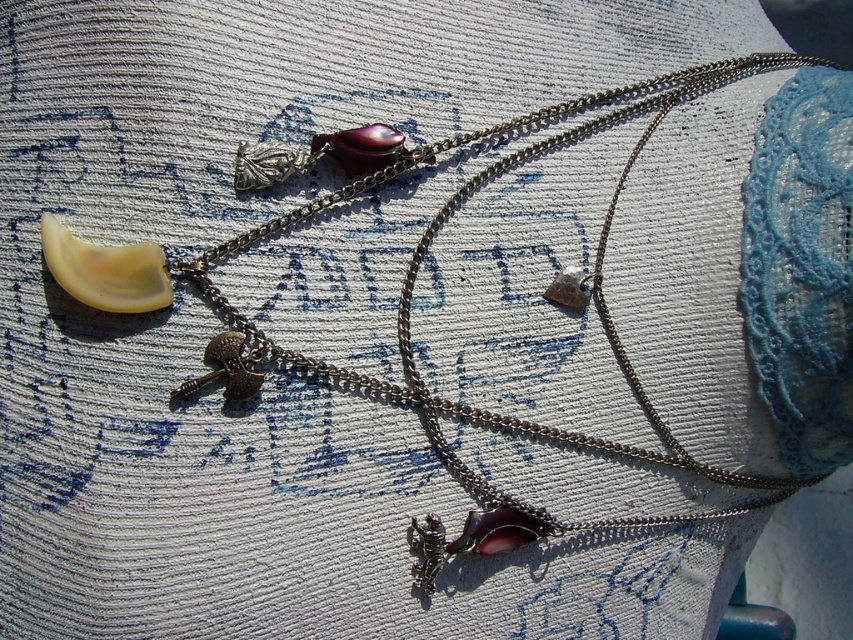
Question: Which of the following is the farthest from the observer?

Choices:
 (A) matte silver charm at center
 (B) gold metallic hammer at center

Answer: (A)

Question: Is gold metallic hammer at center further to the viewer compared to matte silver charm at center?

Choices:
 (A) no
 (B) yes

Answer: (A)

Question: Which of the following is the farthest from the observer?

Choices:
 (A) (575, 292)
 (B) (247, 380)

Answer: (A)

Question: Is the position of gold metallic hammer at center less distant than that of matte silver charm at center?

Choices:
 (A) no
 (B) yes

Answer: (B)

Question: Among these objects, which one is farthest from the camera?

Choices:
 (A) gold metallic hammer at center
 (B) matte silver charm at center

Answer: (B)

Question: Does gold metallic hammer at center have a lesser width compared to matte silver charm at center?

Choices:
 (A) no
 (B) yes

Answer: (A)